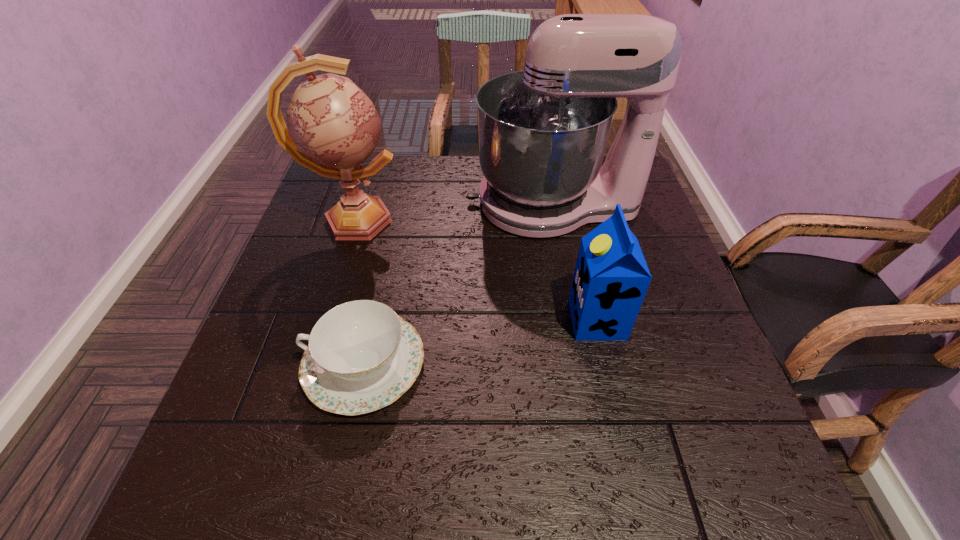
This screenshot has height=540, width=960. Find the location of `vacant area that lies between the globe and the shortest object`. vacant area that lies between the globe and the shortest object is located at coordinates 359,292.

Where is `vacant area that lies between the globe and the mixer`? Image resolution: width=960 pixels, height=540 pixels. vacant area that lies between the globe and the mixer is located at coordinates (453, 212).

The height and width of the screenshot is (540, 960). Find the location of `free area in between the carton and the globe`. free area in between the carton and the globe is located at coordinates (475, 271).

Where is `vacant point located between the shortest object and the mixer`? vacant point located between the shortest object and the mixer is located at coordinates (459, 284).

The image size is (960, 540). What are the coordinates of `object that stands as the closest to the mixer` in the screenshot? It's located at (333, 127).

Select which object is the closest to the second shortest object. Please provide its 2D coordinates. Your answer should be formatted as a tuple, i.e. [(x, y)], where the tuple contains the x and y coordinates of a point satisfying the conditions above.

[(542, 132)]